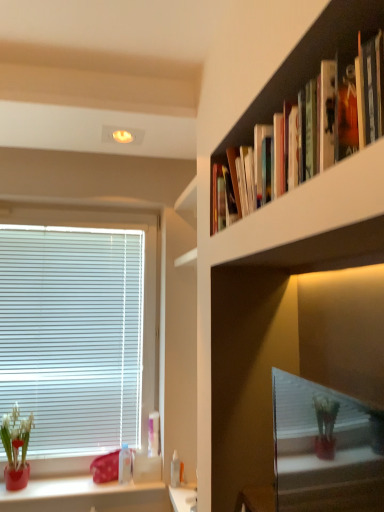
Question: Is white blinds at left surrounding matte ceramic pot at lower left?

Choices:
 (A) yes
 (B) no

Answer: (B)

Question: Is the depth of white blinds at left greater than that of matte ceramic pot at lower left?

Choices:
 (A) no
 (B) yes

Answer: (B)

Question: Is white blinds at left placed right next to matte ceramic pot at lower left?

Choices:
 (A) no
 (B) yes

Answer: (A)

Question: From the image's perspective, is white blinds at left beneath matte ceramic pot at lower left?

Choices:
 (A) yes
 (B) no

Answer: (B)

Question: Does white blinds at left have a smaller size compared to matte ceramic pot at lower left?

Choices:
 (A) no
 (B) yes

Answer: (A)

Question: Can you confirm if white blinds at left is wider than matte ceramic pot at lower left?

Choices:
 (A) yes
 (B) no

Answer: (B)

Question: Considering the relative sizes of transparent plastic bottle at lower center, which ranks as the 2th toiletry in left-to-right order, and transparent plastic bottle at lower left, arranged as the 1th toiletry when viewed from the left, in the image provided, is transparent plastic bottle at lower center, which ranks as the 2th toiletry in left-to-right order, wider than transparent plastic bottle at lower left, arranged as the 1th toiletry when viewed from the left,?

Choices:
 (A) no
 (B) yes

Answer: (A)

Question: Is transparent plastic bottle at lower center, which ranks as the 2th toiletry in left-to-right order, not inside transparent plastic bottle at lower left, which ranks as the third toiletry in right-to-left order?

Choices:
 (A) yes
 (B) no

Answer: (A)

Question: Considering the relative sizes of transparent plastic bottle at lower center, which ranks as the 2th toiletry in left-to-right order, and transparent plastic bottle at lower left, which ranks as the third toiletry in right-to-left order, in the image provided, is transparent plastic bottle at lower center, which ranks as the 2th toiletry in left-to-right order, shorter than transparent plastic bottle at lower left, which ranks as the third toiletry in right-to-left order,?

Choices:
 (A) no
 (B) yes

Answer: (B)

Question: Is transparent plastic bottle at lower left, which ranks as the third toiletry in right-to-left order, a part of transparent plastic bottle at lower center, positioned as the 2th toiletry in right-to-left order?

Choices:
 (A) no
 (B) yes

Answer: (A)

Question: Is the position of transparent plastic bottle at lower center, positioned as the 2th toiletry in right-to-left order, more distant than that of transparent plastic bottle at lower left, which ranks as the third toiletry in right-to-left order?

Choices:
 (A) no
 (B) yes

Answer: (A)

Question: Can you confirm if transparent plastic bottle at lower center, positioned as the 2th toiletry in right-to-left order, is positioned to the left of transparent plastic bottle at lower left, arranged as the 1th toiletry when viewed from the left?

Choices:
 (A) yes
 (B) no

Answer: (B)

Question: Considering the relative sizes of transparent plastic bottle at lower left, which ranks as the third toiletry in right-to-left order, and white plastic bottle at lower center, placed as the third toiletry when sorted from left to right, in the image provided, is transparent plastic bottle at lower left, which ranks as the third toiletry in right-to-left order, taller than white plastic bottle at lower center, placed as the third toiletry when sorted from left to right,?

Choices:
 (A) yes
 (B) no

Answer: (A)